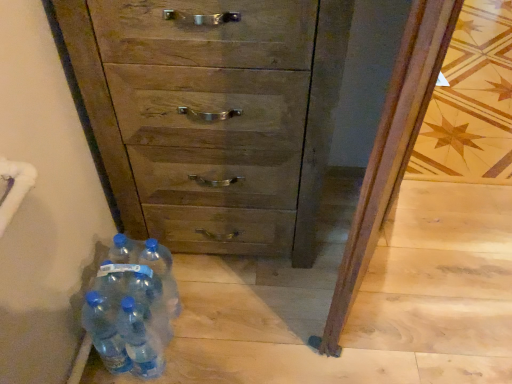
Identify the location of vacant space to the right of translucent plastic water bottles at lower left, the first bottle when ordered from left to right. (195, 349).